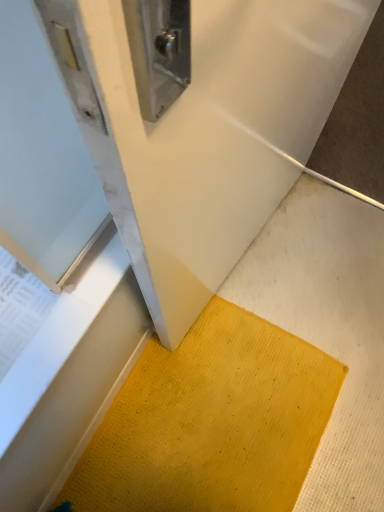
You are a GUI agent. You are given a task and a screenshot of the screen. Output one action in this format:
    pyautogui.click(x=<x>, y=<y>)
    Task: Click on the yellow textured mat at lower center
    This screenshot has height=512, width=384.
    Given the screenshot: What is the action you would take?
    pyautogui.click(x=211, y=422)

This screenshot has width=384, height=512. What do you see at coordinates (211, 422) in the screenshot? I see `yellow textured mat at lower center` at bounding box center [211, 422].

In order to click on yellow textured mat at lower center in this screenshot , I will do `click(202, 129)`.

Describe the element at coordinates (202, 129) in the screenshot. I see `yellow textured mat at lower center` at that location.

Locate an element on the screen. Image resolution: width=384 pixels, height=512 pixels. yellow textured mat at lower center is located at coordinates pyautogui.click(x=211, y=422).

Considering the relative positions of yellow textured mat at lower center and yellow textured mat at lower center in the image provided, is yellow textured mat at lower center to the left of yellow textured mat at lower center from the viewer's perspective?

Correct, you'll find yellow textured mat at lower center to the left of yellow textured mat at lower center.

In the image, is yellow textured mat at lower center positioned in front of or behind yellow textured mat at lower center?

yellow textured mat at lower center is behind yellow textured mat at lower center.

Is point (250, 374) behind point (221, 98)?

Yes.

From the image's perspective, would you say yellow textured mat at lower center is shown under yellow textured mat at lower center?

Yes, from the image's perspective, yellow textured mat at lower center is below yellow textured mat at lower center.

From a real-world perspective, relative to yellow textured mat at lower center, is yellow textured mat at lower center vertically above or below?

From a real-world perspective, yellow textured mat at lower center is physically below yellow textured mat at lower center.

Looking at their sizes, would you say yellow textured mat at lower center is wider or thinner than yellow textured mat at lower center?

Clearly, yellow textured mat at lower center has more width compared to yellow textured mat at lower center.

In terms of height, does yellow textured mat at lower center look taller or shorter compared to yellow textured mat at lower center?

Clearly, yellow textured mat at lower center is shorter compared to yellow textured mat at lower center.

Considering the relative sizes of yellow textured mat at lower center and yellow textured mat at lower center in the image provided, is yellow textured mat at lower center bigger than yellow textured mat at lower center?

Incorrect, yellow textured mat at lower center is not larger than yellow textured mat at lower center.

Is yellow textured mat at lower center completely or partially inside yellow textured mat at lower center?

No, yellow textured mat at lower center is not a part of yellow textured mat at lower center.

Are yellow textured mat at lower center and yellow textured mat at lower center making contact?

There is a gap between yellow textured mat at lower center and yellow textured mat at lower center.

Is yellow textured mat at lower center facing towards yellow textured mat at lower center?

No, yellow textured mat at lower center does not turn towards yellow textured mat at lower center.

This screenshot has width=384, height=512. In order to click on wide lying above the yellow textured mat at lower center (from the image's perspective) in this screenshot , I will do `click(202, 129)`.

Considering the relative positions of yellow textured mat at lower center and yellow textured mat at lower center in the image provided, is yellow textured mat at lower center to the left of yellow textured mat at lower center from the viewer's perspective?

In fact, yellow textured mat at lower center is to the right of yellow textured mat at lower center.

Is yellow textured mat at lower center positioned in front of yellow textured mat at lower center?

Yes, yellow textured mat at lower center is closer to the viewer.

Based on the photo, which is closer to the camera, (86, 21) or (241, 420)?

Point (86, 21) appears to be closer to the viewer than point (241, 420).

In the scene shown: From the image's perspective, which is below, yellow textured mat at lower center or yellow textured mat at lower center?

yellow textured mat at lower center is shown below in the image.

From a real-world perspective, which object rests below the other?

yellow textured mat at lower center, from a real-world perspective.

Does yellow textured mat at lower center have a lesser width compared to yellow textured mat at lower center?

Correct, the width of yellow textured mat at lower center is less than that of yellow textured mat at lower center.

From the picture: Is yellow textured mat at lower center taller or shorter than yellow textured mat at lower center?

yellow textured mat at lower center is taller than yellow textured mat at lower center.

Which of these two, yellow textured mat at lower center or yellow textured mat at lower center, is bigger?

With larger size is yellow textured mat at lower center.

Looking at this image, is yellow textured mat at lower center a part of yellow textured mat at lower center?

No, yellow textured mat at lower center is located outside of yellow textured mat at lower center.

Is yellow textured mat at lower center directly adjacent to yellow textured mat at lower center?

There is a gap between yellow textured mat at lower center and yellow textured mat at lower center.

Is yellow textured mat at lower center turned away from yellow textured mat at lower center?

That's not correct — yellow textured mat at lower center is not looking away from yellow textured mat at lower center.

What's the angular difference between yellow textured mat at lower center and yellow textured mat at lower center's facing directions?

The angular difference between yellow textured mat at lower center and yellow textured mat at lower center is 6.32 degrees.

This screenshot has width=384, height=512. I want to click on doormat behind the yellow textured mat at lower center, so click(211, 422).

You are a GUI agent. You are given a task and a screenshot of the screen. Output one action in this format:
    pyautogui.click(x=<x>, y=<y>)
    Task: Click on the doormat below the yellow textured mat at lower center (from a real-world perspective)
    This screenshot has height=512, width=384.
    Given the screenshot: What is the action you would take?
    pyautogui.click(x=211, y=422)

Where is `doormat lying on the left of yellow textured mat at lower center`? This screenshot has width=384, height=512. doormat lying on the left of yellow textured mat at lower center is located at coordinates pos(211,422).